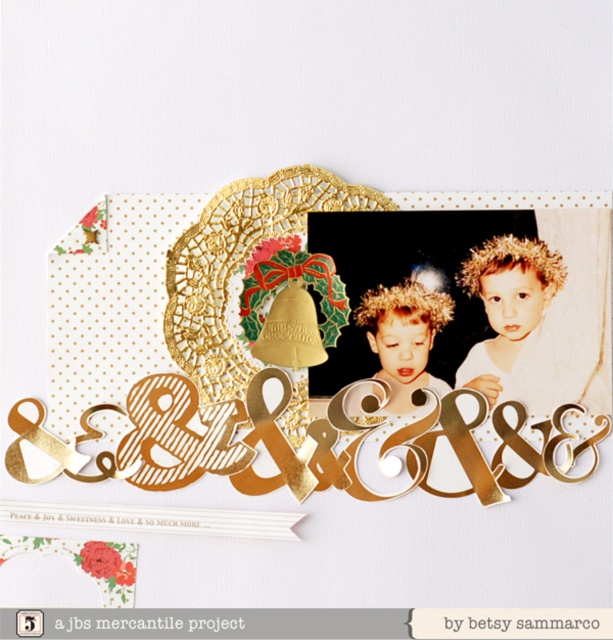
You are designing a scrapbook layout and want to ensure proper spacing between the matte gold photo frame at center and the blonde hair child at center. Based on the scene description, which object is taller and requires more vertical space?

The matte gold photo frame at center is taller than the blonde hair child at center, so it requires more vertical space.

You are organizing a scrapbook and want to ensure that the matte gold photo frame at center and the gold glitter hairband at center are arranged properly. Based on the scene description, which object is closer to the viewer?

The matte gold photo frame at center is closer to the viewer because it is in front of the gold glitter hairband at center.

Looking at the scrapbook page, where is the matte gold photo frame at center in relation to the blonde hair child at center?

The matte gold photo frame at center is to the left of the blonde hair child at center.